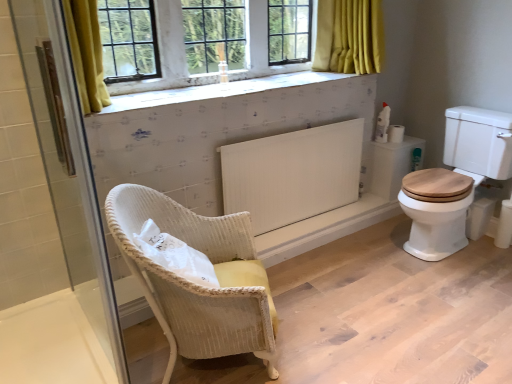
Where is `vacant space to the right of woven yellow chair at center`? The width and height of the screenshot is (512, 384). vacant space to the right of woven yellow chair at center is located at coordinates (332, 326).